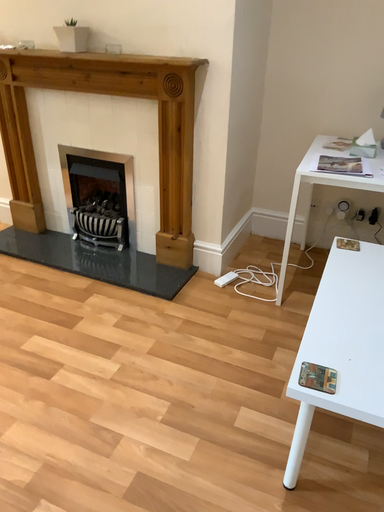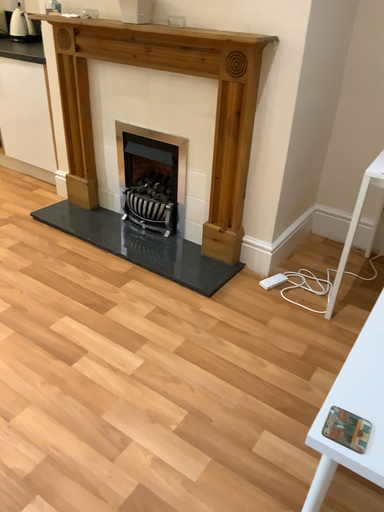
Question: How did the camera likely rotate when shooting the video?

Choices:
 (A) rotated left
 (B) rotated right

Answer: (A)